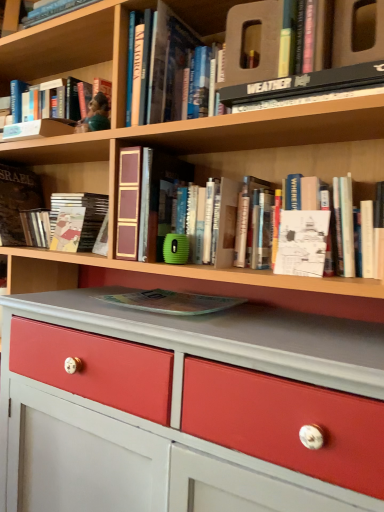
In order to face transparent plastic magazine at center, which is the fifth book from left to right, should I rotate leftwards or rightwards?

A 3.613 degree turn to the left will do.

Where is `hardcover book at upper center, acting as the fifth book starting from the right`? This screenshot has width=384, height=512. hardcover book at upper center, acting as the fifth book starting from the right is located at coordinates (164, 60).

This screenshot has width=384, height=512. Describe the element at coordinates (192, 224) in the screenshot. I see `green rubber eraser at center, placed as the 6th book when sorted from left to right` at that location.

What is the approximate width of brown leather book at left, the first book from the left?

It is 9.82 inches.

This screenshot has width=384, height=512. What do you see at coordinates (302, 243) in the screenshot?
I see `white paper at center` at bounding box center [302, 243].

What is the approximate width of matte green figurine at upper left, the 7th book from the right?

It is 6.46 inches.

At what (x,y) coordinates should I click in order to perform the action: click on white paper book at upper right, which is the eighth book from left to right. Please return your answer as a coordinate pair (x, y). Image resolution: width=384 pixels, height=512 pixels. Looking at the image, I should click on (300, 164).

Is brown leather book at left, the first book from the left, outside of hardcover book at upper center, arranged as the 4th book when viewed from the left?

brown leather book at left, the first book from the left, lies outside hardcover book at upper center, arranged as the 4th book when viewed from the left,'s area.

Considering the sizes of brown leather book at left, marked as the 8th book in a right-to-left arrangement, and hardcover book at upper center, acting as the fifth book starting from the right, in the image, is brown leather book at left, marked as the 8th book in a right-to-left arrangement, bigger or smaller than hardcover book at upper center, acting as the fifth book starting from the right,?

In the image, brown leather book at left, marked as the 8th book in a right-to-left arrangement, appears to be larger than hardcover book at upper center, acting as the fifth book starting from the right.

Is brown leather book at left, marked as the 8th book in a right-to-left arrangement, to the left or to the right of hardcover book at upper center, acting as the fifth book starting from the right, in the image?

In the image, brown leather book at left, marked as the 8th book in a right-to-left arrangement, appears on the left side of hardcover book at upper center, acting as the fifth book starting from the right.

Does brown leather book at left, marked as the 8th book in a right-to-left arrangement, touch hardcover book at upper center, acting as the fifth book starting from the right?

No, brown leather book at left, marked as the 8th book in a right-to-left arrangement, is not making contact with hardcover book at upper center, acting as the fifth book starting from the right.

From a real-world perspective, who is located lower, transparent plastic magazine at center, the fourth book positioned from the right, or brown leather book at left, the first book from the left?

transparent plastic magazine at center, the fourth book positioned from the right.

Considering the sizes of transparent plastic magazine at center, the fourth book positioned from the right, and brown leather book at left, marked as the 8th book in a right-to-left arrangement, in the image, is transparent plastic magazine at center, the fourth book positioned from the right, wider or thinner than brown leather book at left, marked as the 8th book in a right-to-left arrangement,?

transparent plastic magazine at center, the fourth book positioned from the right, is wider than brown leather book at left, marked as the 8th book in a right-to-left arrangement.

Which is behind, point (135, 296) or point (23, 186)?

The point (23, 186) is farther from the camera.

Would you consider transparent plastic magazine at center, which is the fifth book from left to right, to be distant from brown leather book at left, marked as the 8th book in a right-to-left arrangement?

No, transparent plastic magazine at center, which is the fifth book from left to right, is not far from brown leather book at left, marked as the 8th book in a right-to-left arrangement.

The image size is (384, 512). I want to click on the 3rd book above the transparent plastic magazine at center, the fourth book positioned from the right (from a real-world perspective), so click(x=300, y=164).

Does white paper book at upper right, which is the eighth book from left to right, have a greater width compared to transparent plastic magazine at center, which is the fifth book from left to right?

In fact, white paper book at upper right, which is the eighth book from left to right, might be narrower than transparent plastic magazine at center, which is the fifth book from left to right.

Is transparent plastic magazine at center, which is the fifth book from left to right, a part of white paper book at upper right, which is the eighth book from left to right?

No, transparent plastic magazine at center, which is the fifth book from left to right, is not surrounded by white paper book at upper right, which is the eighth book from left to right.

Considering the relative sizes of white paper book at upper right, which is the eighth book from left to right, and transparent plastic magazine at center, which is the fifth book from left to right, in the image provided, is white paper book at upper right, which is the eighth book from left to right, shorter than transparent plastic magazine at center, which is the fifth book from left to right,?

In fact, white paper book at upper right, which is the eighth book from left to right, may be taller than transparent plastic magazine at center, which is the fifth book from left to right.

From a real-world perspective, who is located lower, white paper book at upper right, which is the eighth book from left to right, or white paper at center?

white paper at center, from a real-world perspective.

Is white paper book at upper right, which is the eighth book from left to right, positioned with its back to white paper at center?

Correct, white paper book at upper right, which is the eighth book from left to right, is looking away from white paper at center.

Can you confirm if white paper book at upper right, which is the eighth book from left to right, is thinner than white paper at center?

No.

What's the angular difference between white paper book at upper right, placed as the 1th book when sorted from right to left, and white paper at center's facing directions?

The angular difference between white paper book at upper right, placed as the 1th book when sorted from right to left, and white paper at center is 0.104 degrees.

Which is behind, point (146, 73) or point (186, 205)?

The point (186, 205) is farther.

Is hardcover book at upper center, acting as the fifth book starting from the right, far away from green rubber eraser at center, marked as the 3th book in a right-to-left arrangement?

No, hardcover book at upper center, acting as the fifth book starting from the right, is not far away from green rubber eraser at center, marked as the 3th book in a right-to-left arrangement.

Is hardcover book at upper center, acting as the fifth book starting from the right, bigger or smaller than green rubber eraser at center, placed as the 6th book when sorted from left to right?

Considering their sizes, hardcover book at upper center, acting as the fifth book starting from the right, takes up more space than green rubber eraser at center, placed as the 6th book when sorted from left to right.

Considering the sizes of hardcover book at upper center, acting as the fifth book starting from the right, and green rubber eraser at center, placed as the 6th book when sorted from left to right, in the image, is hardcover book at upper center, acting as the fifth book starting from the right, wider or thinner than green rubber eraser at center, placed as the 6th book when sorted from left to right,?

hardcover book at upper center, acting as the fifth book starting from the right, is wider than green rubber eraser at center, placed as the 6th book when sorted from left to right.

Can we say green rubber eraser at center, marked as the 3th book in a right-to-left arrangement, lies outside black hardcover book at upper center, the 2th book when ordered from right to left?

Yes, green rubber eraser at center, marked as the 3th book in a right-to-left arrangement, is outside of black hardcover book at upper center, the 2th book when ordered from right to left.

Considering the relative sizes of green rubber eraser at center, placed as the 6th book when sorted from left to right, and black hardcover book at upper center, acting as the seventh book starting from the left, in the image provided, is green rubber eraser at center, placed as the 6th book when sorted from left to right, bigger than black hardcover book at upper center, acting as the seventh book starting from the left,?

Yes, green rubber eraser at center, placed as the 6th book when sorted from left to right, is bigger than black hardcover book at upper center, acting as the seventh book starting from the left.

Between green rubber eraser at center, placed as the 6th book when sorted from left to right, and black hardcover book at upper center, acting as the seventh book starting from the left, which one has smaller width?

green rubber eraser at center, placed as the 6th book when sorted from left to right, is thinner.

Is point (194, 221) positioned in front of point (369, 76)?

That is False.

From a real-world perspective, which object stands above the other?

matte green figurine at upper left, the 7th book from the right, is physically above.

What's the angular difference between matte green figurine at upper left, acting as the 2th book starting from the left, and matte hardcover book at center, which is counted as the sixth book, starting from the right,'s facing directions?

There is a 7.31-degree angle between the facing directions of matte green figurine at upper left, acting as the 2th book starting from the left, and matte hardcover book at center, which is counted as the sixth book, starting from the right.

Considering the relative sizes of matte green figurine at upper left, acting as the 2th book starting from the left, and matte hardcover book at center, which is counted as the sixth book, starting from the right, in the image provided, is matte green figurine at upper left, acting as the 2th book starting from the left, thinner than matte hardcover book at center, which is counted as the sixth book, starting from the right,?

Incorrect, the width of matte green figurine at upper left, acting as the 2th book starting from the left, is not less than that of matte hardcover book at center, which is counted as the sixth book, starting from the right.

Image resolution: width=384 pixels, height=512 pixels. I want to click on the 3rd book positioned above the brown leather book at left, marked as the 8th book in a right-to-left arrangement (from the image's perspective), so click(x=164, y=60).

Where is `the 5th book behind the transparent plastic magazine at center, the fourth book positioned from the right, starting your count from the anchor`? The height and width of the screenshot is (512, 384). the 5th book behind the transparent plastic magazine at center, the fourth book positioned from the right, starting your count from the anchor is located at coordinates (17, 201).

Considering their positions, is matte green figurine at upper left, acting as the 2th book starting from the left, positioned further to green rubber eraser at center, placed as the 6th book when sorted from left to right, than brown leather book at left, the first book from the left?

The object further to green rubber eraser at center, placed as the 6th book when sorted from left to right, is brown leather book at left, the first book from the left.

Considering their positions, is black hardcover book at upper center, acting as the seventh book starting from the left, positioned further to matte green figurine at upper left, the 7th book from the right, than white paper book at upper right, which is the eighth book from left to right?

black hardcover book at upper center, acting as the seventh book starting from the left.

Based on their spatial positions, is hardcover book at upper center, arranged as the 4th book when viewed from the left, or black hardcover book at upper center, acting as the seventh book starting from the left, closer to transparent plastic magazine at center, which is the fifth book from left to right?

black hardcover book at upper center, acting as the seventh book starting from the left, is closer to transparent plastic magazine at center, which is the fifth book from left to right.

Which object lies further to the anchor point black hardcover book at upper center, acting as the seventh book starting from the left, transparent plastic magazine at center, which is the fifth book from left to right, or white paper at center?

transparent plastic magazine at center, which is the fifth book from left to right, is positioned further to the anchor black hardcover book at upper center, acting as the seventh book starting from the left.

Looking at this image, based on their spatial positions, is white paper at center or matte hardcover book at center, which is counted as the sixth book, starting from the right, closer to black hardcover book at upper center, the 2th book when ordered from right to left?

white paper at center lies closer to black hardcover book at upper center, the 2th book when ordered from right to left, than the other object.

Looking at the image, which one is located further to transparent plastic magazine at center, the fourth book positioned from the right, matte hardcover book at center, which is counted as the sixth book, starting from the right, or brown leather book at left, the first book from the left?

The object further to transparent plastic magazine at center, the fourth book positioned from the right, is brown leather book at left, the first book from the left.

Based on their spatial positions, is hardcover book at upper center, arranged as the 4th book when viewed from the left, or matte green figurine at upper left, acting as the 2th book starting from the left, closer to white paper book at upper right, which is the eighth book from left to right?

hardcover book at upper center, arranged as the 4th book when viewed from the left, lies closer to white paper book at upper right, which is the eighth book from left to right, than the other object.

Estimate the real-world distances between objects in this image. Which object is closer to brown leather book at left, marked as the 8th book in a right-to-left arrangement, green rubber eraser at center, placed as the 6th book when sorted from left to right, or white paper book at upper right, placed as the 1th book when sorted from right to left?

green rubber eraser at center, placed as the 6th book when sorted from left to right, is closer to brown leather book at left, marked as the 8th book in a right-to-left arrangement.

Find the location of a particular element. The image size is (384, 512). paperback book between matte green figurine at upper left, acting as the 2th book starting from the left, and black hardcover book at upper center, the 2th book when ordered from right to left is located at coordinates (302, 243).

Where is `paperback book situated between matte green figurine at upper left, acting as the 2th book starting from the left, and white paper book at upper right, which is the eighth book from left to right, from left to right`? paperback book situated between matte green figurine at upper left, acting as the 2th book starting from the left, and white paper book at upper right, which is the eighth book from left to right, from left to right is located at coordinates (302, 243).

Where is `paperback book between black hardcover book at upper center, the 2th book when ordered from right to left, and transparent plastic magazine at center, which is the fifth book from left to right, from top to bottom`? paperback book between black hardcover book at upper center, the 2th book when ordered from right to left, and transparent plastic magazine at center, which is the fifth book from left to right, from top to bottom is located at coordinates (302, 243).

This screenshot has width=384, height=512. In order to click on book between matte green figurine at upper left, the 7th book from the right, and hardcover book at upper center, acting as the fifth book starting from the right, from left to right in this screenshot , I will do `click(78, 221)`.